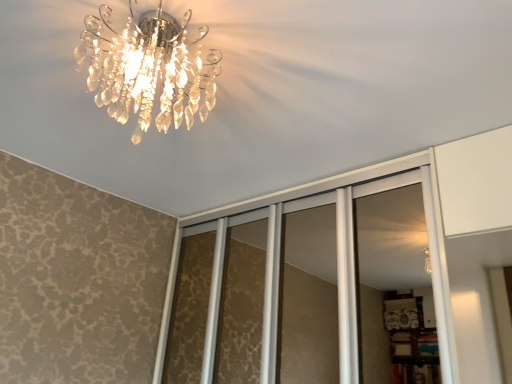
Measure the distance between white glossy sliding door at center and camera.

The depth of white glossy sliding door at center is 1.46 meters.

This screenshot has width=512, height=384. Describe the element at coordinates (302, 286) in the screenshot. I see `white glossy sliding door at center` at that location.

Where is `white glossy sliding door at center`? This screenshot has width=512, height=384. white glossy sliding door at center is located at coordinates (302, 286).

Where is `white glossy sliding door at center`? white glossy sliding door at center is located at coordinates (302, 286).